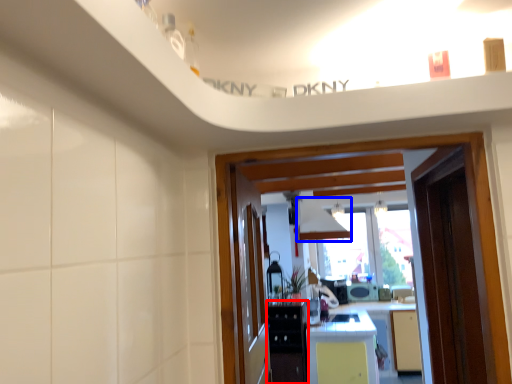
Question: Among these objects, which one is farthest to the camera, cabinetry (highlighted by a red box) or exhaust hood (highlighted by a blue box)?

Choices:
 (A) cabinetry
 (B) exhaust hood

Answer: (B)